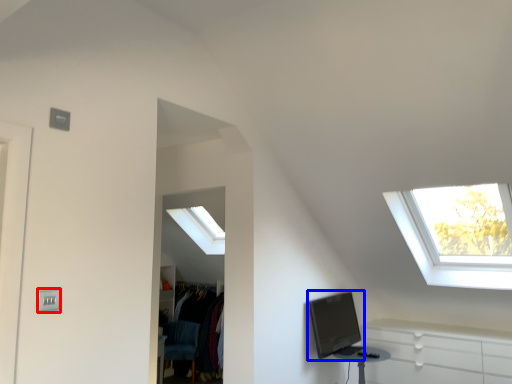
Question: Which point is further to the camera, electric outlet (highlighted by a red box) or computer monitor (highlighted by a blue box)?

Choices:
 (A) electric outlet
 (B) computer monitor

Answer: (B)